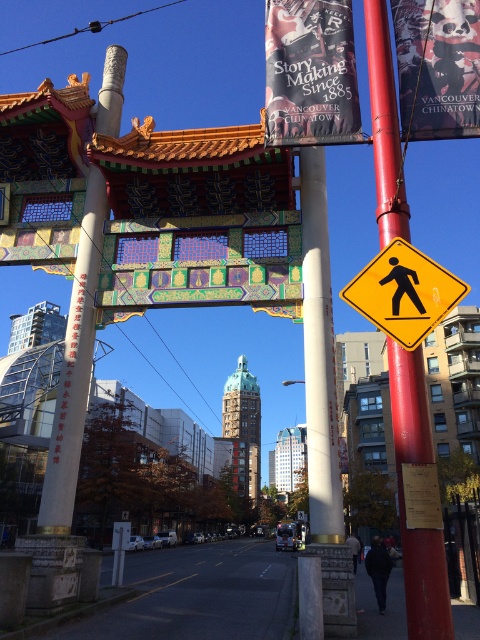
Can you confirm if smooth red pole at right is taller than black fabric banner at upper center?

Yes.

Find the location of a particular element. Image resolution: width=480 pixels, height=640 pixels. smooth red pole at right is located at coordinates (404, 500).

This screenshot has width=480, height=640. Describe the element at coordinates (404, 500) in the screenshot. I see `smooth red pole at right` at that location.

I want to click on smooth red pole at right, so point(404,500).

Between point (307, 99) and point (470, 42), which one is positioned behind?

Positioned behind is point (307, 99).

Is black fabric banner at upper center positioned before matte paper poster at upper right?

No, black fabric banner at upper center is further to the viewer.

Is point (265, 45) behind point (403, 132)?

Yes.

You are a GUI agent. You are given a task and a screenshot of the screen. Output one action in this format:
    pyautogui.click(x=<x>, y=<y>)
    Task: Click on the black fabric banner at upper center
    
    Given the screenshot: What is the action you would take?
    pyautogui.click(x=311, y=74)

Which is in front, point (383, 209) or point (407, 93)?

Point (383, 209) is in front.

Can you confirm if smooth red pole at right is positioned above matte paper poster at upper right?

No, smooth red pole at right is not above matte paper poster at upper right.

Find the location of a particular element. This screenshot has width=480, height=640. smooth red pole at right is located at coordinates (404, 500).